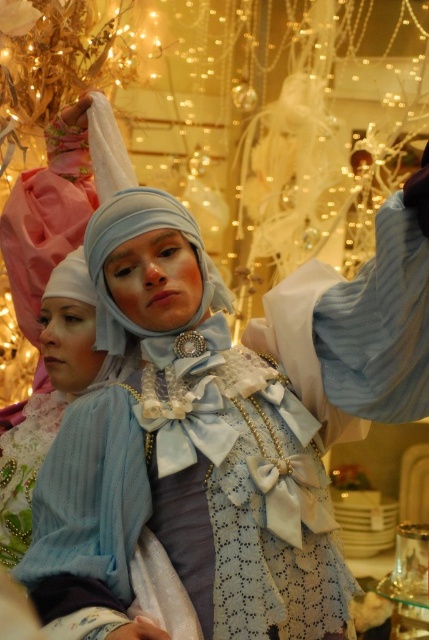
Question: Does matte blue fabric dress at center appear on the right side of light blue fabric headdress at center?

Choices:
 (A) no
 (B) yes

Answer: (B)

Question: Among these points, which one is farthest from the camera?

Choices:
 (A) (130, 192)
 (B) (38, 595)

Answer: (A)

Question: Does matte blue fabric dress at center appear on the left side of light blue fabric headdress at center?

Choices:
 (A) yes
 (B) no

Answer: (B)

Question: Does matte blue fabric dress at center have a larger size compared to light blue fabric headdress at center?

Choices:
 (A) yes
 (B) no

Answer: (A)